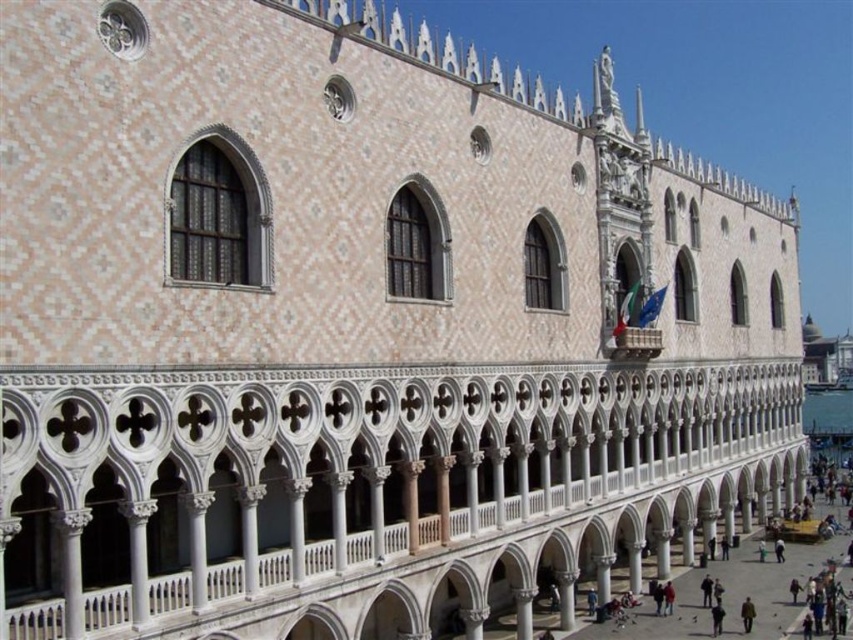
Question: Estimate the real-world distances between objects in this image. Which object is closer to the white stone balcony at center?

Choices:
 (A) dark gray fabric person at lower right
 (B) green fabric coat at center

Answer: (A)

Question: Does green fabric coat at center lie behind dark gray fabric person at lower right?

Choices:
 (A) no
 (B) yes

Answer: (B)

Question: Can you confirm if white stone balcony at center is positioned to the right of dark gray fabric person at lower right?

Choices:
 (A) yes
 (B) no

Answer: (B)

Question: Can you confirm if white stone balcony at center is positioned to the left of green fabric coat at center?

Choices:
 (A) yes
 (B) no

Answer: (A)

Question: Which point appears closest to the camera in this image?

Choices:
 (A) (718, 625)
 (B) (73, 509)

Answer: (B)

Question: Which point appears farthest from the camera in this image?

Choices:
 (A) (747, 609)
 (B) (715, 616)
 (C) (363, 396)

Answer: (B)